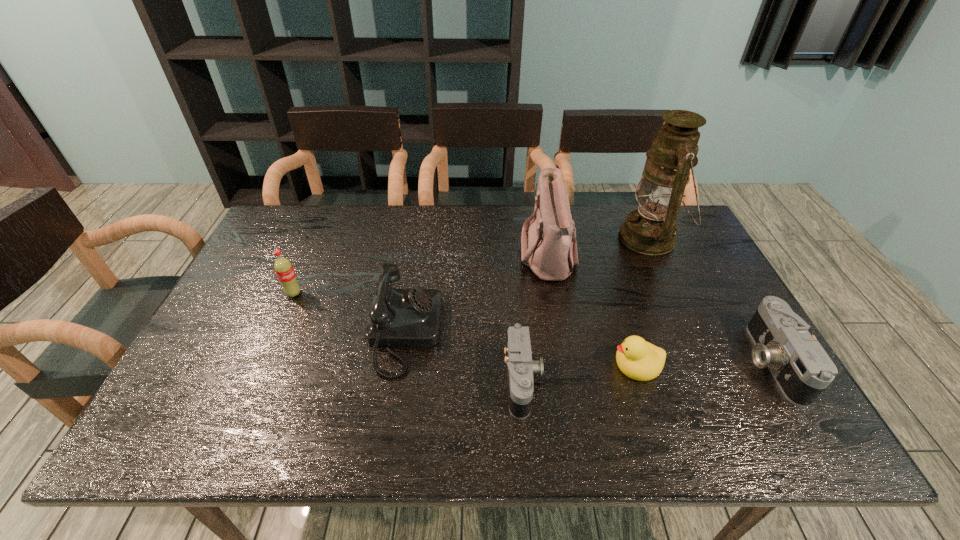
At what (x,y) coordinates should I click in order to perform the action: click on vacant point located 0.070m on the lens of the fifth tallest object. Please return your answer as a coordinate pair (x, y). This screenshot has height=540, width=960. Looking at the image, I should click on (720, 362).

Where is `free space located 0.130m on the lens of the fifth tallest object`? free space located 0.130m on the lens of the fifth tallest object is located at coordinates (x=695, y=362).

Locate an element on the screen. The width and height of the screenshot is (960, 540). free point located on the lens of the fifth tallest object is located at coordinates (711, 362).

At what (x,y) coordinates should I click in order to perform the action: click on vacant region located 0.050m on the front pocket of the second tallest object. Please return your answer as a coordinate pair (x, y). Looking at the image, I should click on (504, 258).

This screenshot has height=540, width=960. I want to click on vacant region located 0.140m on the front pocket of the second tallest object, so click(x=474, y=258).

Locate an element on the screen. free spot located on the front pocket of the second tallest object is located at coordinates (422, 258).

This screenshot has width=960, height=540. In order to click on free space located on the dial of the telephone in this screenshot , I will do `click(571, 333)`.

Identify the location of free space located 0.220m on the left of the tallest object. Image resolution: width=960 pixels, height=540 pixels. (551, 238).

Where is `vacant region located on the right of the soda`? The width and height of the screenshot is (960, 540). vacant region located on the right of the soda is located at coordinates (440, 294).

Where is `free spot located on the face of the duckling`? The width and height of the screenshot is (960, 540). free spot located on the face of the duckling is located at coordinates (509, 364).